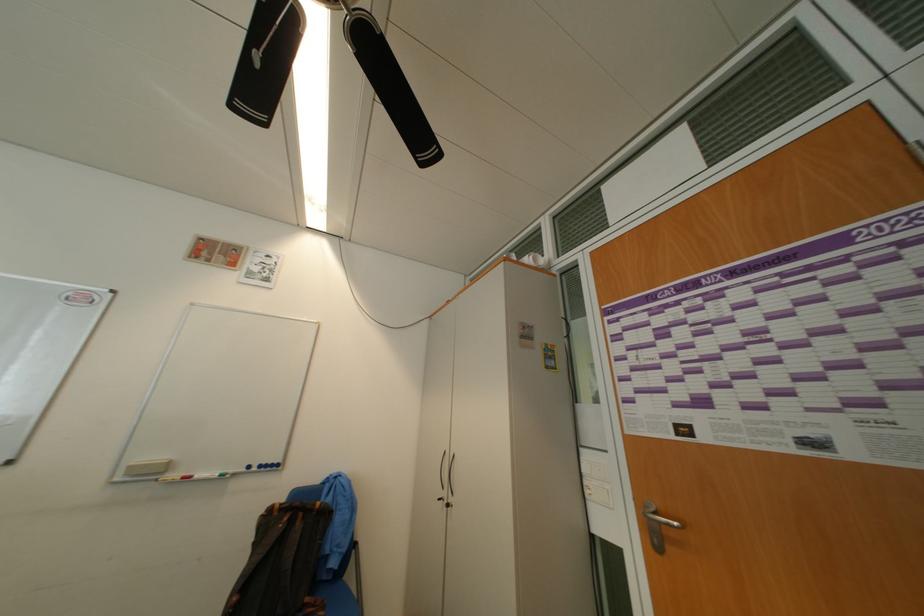
I want to click on black cabinet handle, so [445, 477].